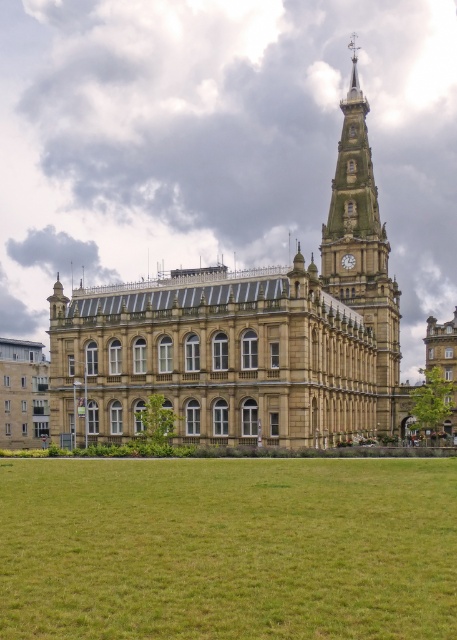
You are standing on the green grass at lower center and want to take a photo of the golden stone clock tower at upper right. Which direction should you face to capture the tower in your shot?

Since the green grass at lower center is positioned under the golden stone clock tower at upper right, you should face upward to capture the tower in your shot.

You are standing on the green grass at lower center in front of the historic building. There is a point marked at coordinates (228, 548). Is this point located on the green grass at lower center or somewhere else?

The point marked at coordinates (228, 548) is located on the green grass at lower center as stated in the description.